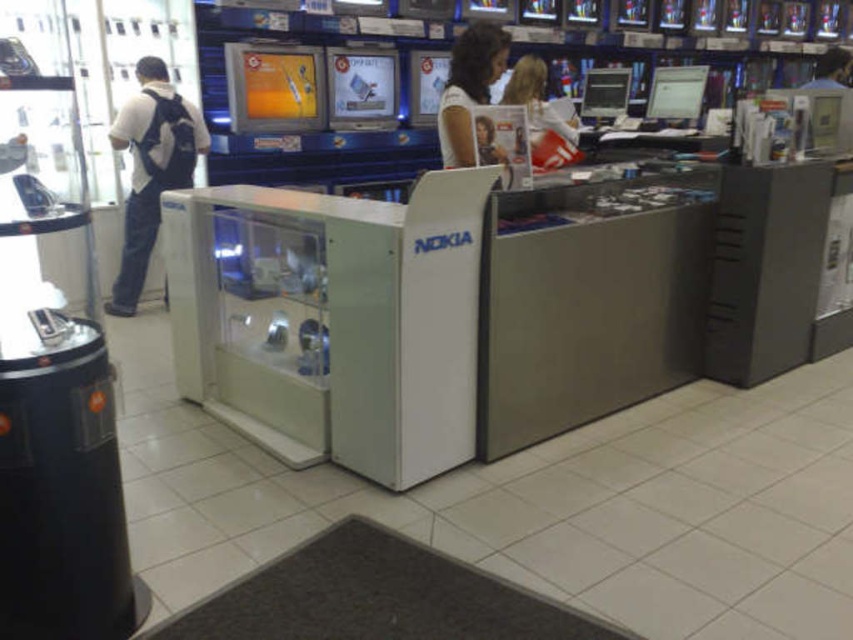
This screenshot has height=640, width=853. In order to click on white fabric backpack at left in this screenshot , I will do `click(151, 168)`.

Can you confirm if white fabric backpack at left is smaller than blonde hair at center?

Incorrect, white fabric backpack at left is not smaller in size than blonde hair at center.

You are a GUI agent. You are given a task and a screenshot of the screen. Output one action in this format:
    pyautogui.click(x=<x>, y=<y>)
    Task: Click on the white fabric backpack at left
    
    Given the screenshot: What is the action you would take?
    pyautogui.click(x=151, y=168)